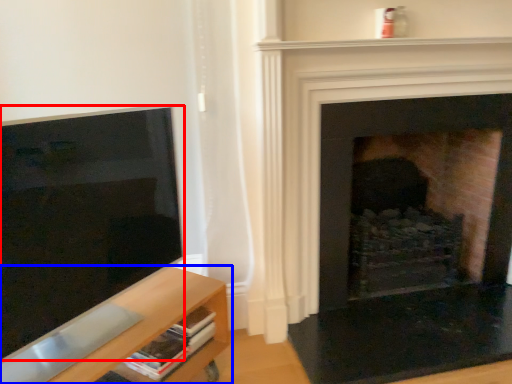
Question: Which object is further to the camera taking this photo, screen (highlighted by a red box) or shelf (highlighted by a blue box)?

Choices:
 (A) screen
 (B) shelf

Answer: (B)